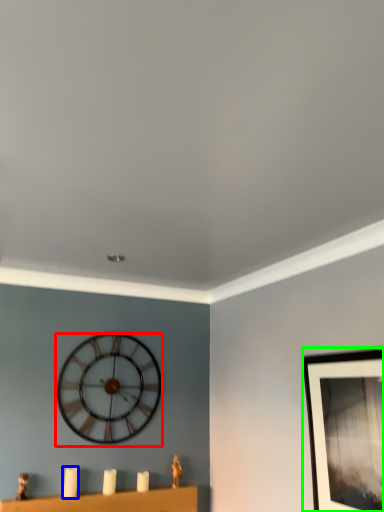
Question: Which is nearer to the wall clock (highlighted by a red box)? candle (highlighted by a blue box) or picture frame (highlighted by a green box).

Choices:
 (A) candle
 (B) picture frame

Answer: (A)